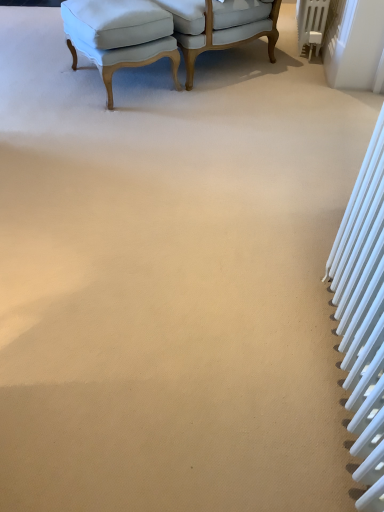
Identify the location of free location in front of light blue fabric ottoman at upper left, the 1th chair positioned from the left. (71, 121).